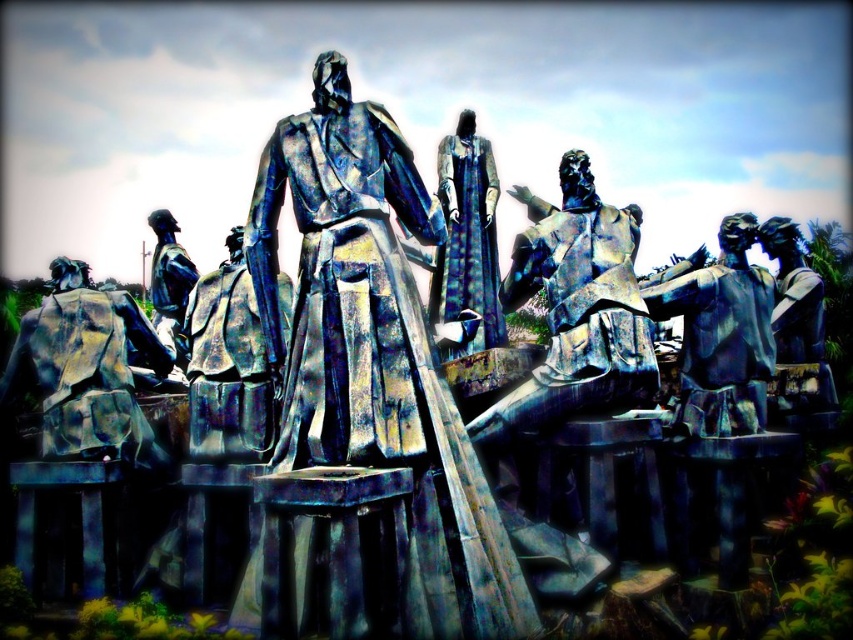
Question: Among these objects, which one is nearest to the camera?

Choices:
 (A) brushed metal backpack at lower left
 (B) blue-green patina statue at center

Answer: (B)

Question: Is brushed metal backpack at lower left in front of blue-green patina statue at center?

Choices:
 (A) no
 (B) yes

Answer: (A)

Question: Does shiny bronze statue at right have a lesser width compared to blue-green patina statue at center?

Choices:
 (A) no
 (B) yes

Answer: (A)

Question: Is shiny bronze statue at right below blue-green patina statue at center?

Choices:
 (A) no
 (B) yes

Answer: (B)

Question: Which point appears closest to the camera in this image?

Choices:
 (A) (103, 390)
 (B) (674, 422)
 (C) (277, 436)

Answer: (C)

Question: Which point is farther to the camera?

Choices:
 (A) blue-green patina statue at center
 (B) brushed metal backpack at lower left
 (C) bronze statue at center

Answer: (B)